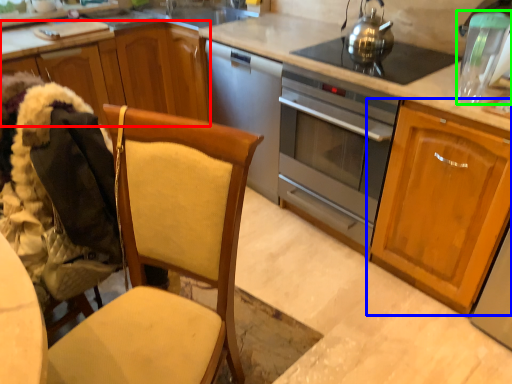
Question: Which object is positioned farthest from cabinetry (highlighted by a red box)? Select from cabinetry (highlighted by a blue box) and appliance (highlighted by a green box).

Choices:
 (A) cabinetry
 (B) appliance

Answer: (B)